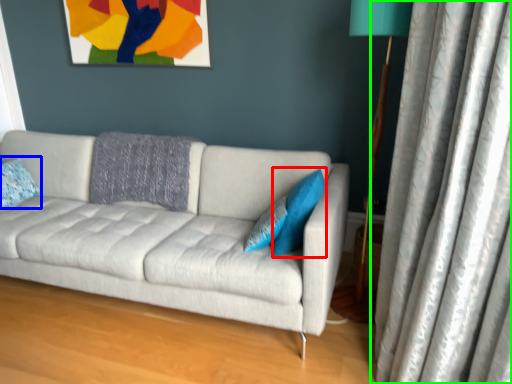
Question: Which object is positioned farthest from pillow (highlighted by a red box)? Select from pillow (highlighted by a blue box) and curtain (highlighted by a green box).

Choices:
 (A) pillow
 (B) curtain

Answer: (A)